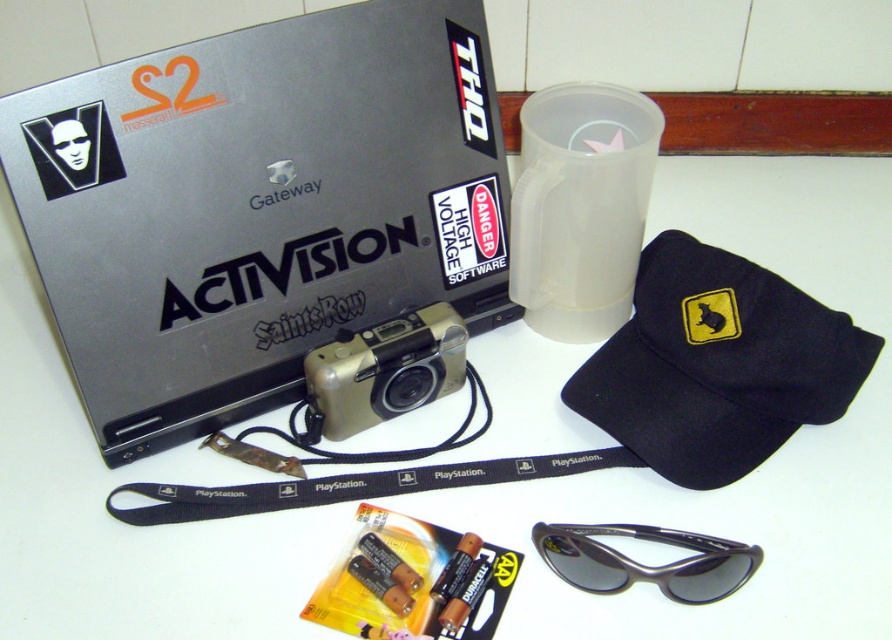
Question: Which point is closer to the camera?

Choices:
 (A) (547, 465)
 (B) (753, 570)
 (C) (600, 394)

Answer: (B)

Question: Where is silver/black plastic laptop at upper left located in relation to black fabric lanyard at center in the image?

Choices:
 (A) above
 (B) below

Answer: (A)

Question: Is silver/black plastic laptop at upper left to the right of metallic silver camera at center from the viewer's perspective?

Choices:
 (A) yes
 (B) no

Answer: (B)

Question: Is silver/black plastic laptop at upper left above black fabric baseball cap at center-right?

Choices:
 (A) no
 (B) yes

Answer: (B)

Question: Among these objects, which one is nearest to the camera?

Choices:
 (A) silver/black plastic laptop at upper left
 (B) black plastic goggles at lower center

Answer: (A)

Question: Among these objects, which one is farthest from the camera?

Choices:
 (A) metallic silver camera at center
 (B) black plastic goggles at lower center
 (C) black fabric baseball cap at center-right

Answer: (A)